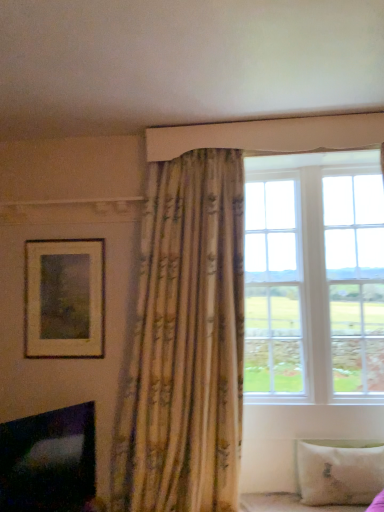
Image resolution: width=384 pixels, height=512 pixels. What do you see at coordinates (64, 298) in the screenshot?
I see `matte gold picture frame at upper left` at bounding box center [64, 298].

Where is `matte gold picture frame at upper left`? The width and height of the screenshot is (384, 512). matte gold picture frame at upper left is located at coordinates (64, 298).

In order to face black glossy fireplace at lower left, should I rotate leftwards or rightwards?

Rotate left and turn 17.905 degrees.

What do you see at coordinates (289, 504) in the screenshot? Image resolution: width=384 pixels, height=512 pixels. I see `white fabric bed frame at lower right` at bounding box center [289, 504].

What do you see at coordinates (185, 343) in the screenshot? The image size is (384, 512). I see `textured beige curtain at center` at bounding box center [185, 343].

The image size is (384, 512). I want to click on matte gold picture frame at upper left, so click(x=64, y=298).

The height and width of the screenshot is (512, 384). I want to click on window in front of the matte gold picture frame at upper left, so click(x=314, y=278).

Is white wood window at upper right inside or outside of matte gold picture frame at upper left?

white wood window at upper right is outside matte gold picture frame at upper left.

Is white wood window at upper right directly adjacent to matte gold picture frame at upper left?

There is a gap between white wood window at upper right and matte gold picture frame at upper left.

Is white wood window at upper right to the left or to the right of matte gold picture frame at upper left in the image?

In the image, white wood window at upper right appears on the right side of matte gold picture frame at upper left.

Based on their sizes in the image, would you say white soft pillow at lower right is bigger or smaller than textured beige curtain at center?

In the image, white soft pillow at lower right appears to be smaller than textured beige curtain at center.

Where is `pillow that appears below the textured beige curtain at center (from the image's perspective)`? This screenshot has height=512, width=384. pillow that appears below the textured beige curtain at center (from the image's perspective) is located at coordinates (339, 472).

From the picture: Is white soft pillow at lower right spatially inside textured beige curtain at center, or outside of it?

white soft pillow at lower right is located beyond the bounds of textured beige curtain at center.

Considering the sizes of white soft pillow at lower right and textured beige curtain at center in the image, is white soft pillow at lower right wider or thinner than textured beige curtain at center?

white soft pillow at lower right is thinner than textured beige curtain at center.

Considering the positions of point (286, 504) and point (39, 334), is point (286, 504) closer or farther from the camera than point (39, 334)?

Point (286, 504) appears to be closer to the viewer than point (39, 334).

In the scene shown: Relative to matte gold picture frame at upper left, is white fabric bed frame at lower right in front or behind?

In the image, white fabric bed frame at lower right appears in front of matte gold picture frame at upper left.

Locate an element on the screen. The image size is (384, 512). picture frame above the white fabric bed frame at lower right (from the image's perspective) is located at coordinates (64, 298).

Is white fabric bed frame at lower right aimed at matte gold picture frame at upper left?

No.

Between point (357, 454) and point (318, 210), which one is positioned behind?

The point (318, 210) is behind.

Considering the relative positions of white soft pillow at lower right and white wood window at upper right in the image provided, is white soft pillow at lower right to the left of white wood window at upper right from the viewer's perspective?

No, white soft pillow at lower right is not to the left of white wood window at upper right.

Which of these two, white soft pillow at lower right or white wood window at upper right, is smaller?

With smaller size is white soft pillow at lower right.

From the picture: Is white soft pillow at lower right in front of or behind white wood window at upper right in the image?

white soft pillow at lower right is positioned farther from the viewer than white wood window at upper right.

Looking at this image, from a real-world perspective, is matte gold picture frame at upper left positioned above or below white fabric bed frame at lower right?

Clearly, from a real-world perspective, matte gold picture frame at upper left is above white fabric bed frame at lower right.

In terms of size, does matte gold picture frame at upper left appear bigger or smaller than white fabric bed frame at lower right?

Considering their sizes, matte gold picture frame at upper left takes up less space than white fabric bed frame at lower right.

Between matte gold picture frame at upper left and white fabric bed frame at lower right, which one appears on the right side from the viewer's perspective?

white fabric bed frame at lower right.

Does matte gold picture frame at upper left have a greater width compared to white fabric bed frame at lower right?

→ No, matte gold picture frame at upper left is not wider than white fabric bed frame at lower right.

Consider the image. From a real-world perspective, is textured beige curtain at center physically located above or below black glossy fireplace at lower left?

In terms of real-world spatial position, textured beige curtain at center is above black glossy fireplace at lower left.

This screenshot has height=512, width=384. What are the coordinates of `curtain located above the black glossy fireplace at lower left (from a real-world perspective)` in the screenshot? It's located at (185, 343).

Considering the relative positions of textured beige curtain at center and black glossy fireplace at lower left in the image provided, is textured beige curtain at center behind black glossy fireplace at lower left?

Yes.

From the image's perspective, between textured beige curtain at center and black glossy fireplace at lower left, which one is located above?

textured beige curtain at center appears higher in the image.

From a real-world perspective, between matte gold picture frame at upper left and textured beige curtain at center, who is vertically lower?

textured beige curtain at center.

Does point (87, 252) come behind point (151, 293)?

Yes, it is.

What are the coordinates of `picture frame on the left of textured beige curtain at center` in the screenshot? It's located at (64, 298).

Considering the positions of objects matte gold picture frame at upper left and textured beige curtain at center in the image provided, who is more to the left, matte gold picture frame at upper left or textured beige curtain at center?

Positioned to the left is matte gold picture frame at upper left.

The height and width of the screenshot is (512, 384). There is a matte gold picture frame at upper left. Find the location of `window above it (from a real-world perspective)`. window above it (from a real-world perspective) is located at coordinates (314, 278).

Identify the location of curtain above the white soft pillow at lower right (from the image's perspective). (185, 343).

Considering their positions, is white wood window at upper right positioned further to black glossy fireplace at lower left than matte gold picture frame at upper left?

The object further to black glossy fireplace at lower left is white wood window at upper right.

Which object lies nearer to the anchor point textured beige curtain at center, white wood window at upper right or black glossy fireplace at lower left?

black glossy fireplace at lower left lies closer to textured beige curtain at center than the other object.

Considering their positions, is white wood window at upper right positioned closer to white fabric bed frame at lower right than black glossy fireplace at lower left?

black glossy fireplace at lower left.

Estimate the real-world distances between objects in this image. Which object is further from white fabric bed frame at lower right, textured beige curtain at center or white soft pillow at lower right?

textured beige curtain at center is positioned further to the anchor white fabric bed frame at lower right.

From the image, which object appears to be nearer to matte gold picture frame at upper left, white soft pillow at lower right or white fabric bed frame at lower right?

Among the two, white fabric bed frame at lower right is located nearer to matte gold picture frame at upper left.

Estimate the real-world distances between objects in this image. Which object is closer to black glossy fireplace at lower left, white soft pillow at lower right or white fabric bed frame at lower right?

white fabric bed frame at lower right is closer to black glossy fireplace at lower left.

Estimate the real-world distances between objects in this image. Which object is closer to black glossy fireplace at lower left, white fabric bed frame at lower right or white soft pillow at lower right?

Based on the image, white fabric bed frame at lower right appears to be nearer to black glossy fireplace at lower left.

Looking at the image, which one is located closer to textured beige curtain at center, white soft pillow at lower right or white wood window at upper right?

white wood window at upper right is closer to textured beige curtain at center.

The width and height of the screenshot is (384, 512). I want to click on curtain between matte gold picture frame at upper left and black glossy fireplace at lower left from top to bottom, so click(185, 343).

At what (x,y) coordinates should I click in order to perform the action: click on curtain situated between black glossy fireplace at lower left and white fabric bed frame at lower right from left to right. Please return your answer as a coordinate pair (x, y). Looking at the image, I should click on (185, 343).

This screenshot has height=512, width=384. Find the location of `fireplace between matte gold picture frame at upper left and white fabric bed frame at lower right in the horizontal direction`. fireplace between matte gold picture frame at upper left and white fabric bed frame at lower right in the horizontal direction is located at coordinates (49, 461).

In order to click on curtain between matte gold picture frame at upper left and white fabric bed frame at lower right in this screenshot , I will do pyautogui.click(x=185, y=343).